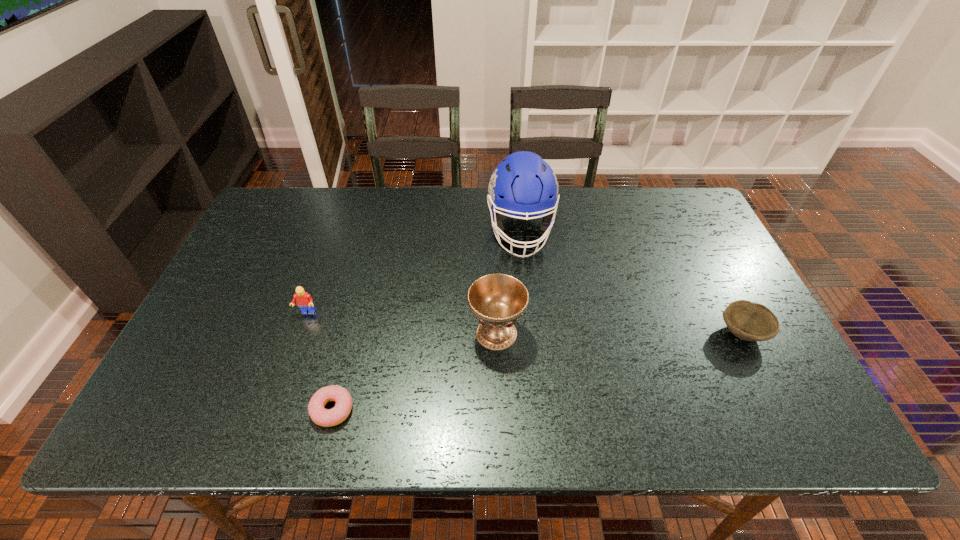
In the image, there is a desktop. Identify the location of vacant space at the right edge. (739, 350).

Locate an element on the screen. This screenshot has height=540, width=960. free space at the far right corner of the desktop is located at coordinates (677, 228).

Locate an element on the screen. free space between the leftmost object and the tallest object is located at coordinates (414, 272).

Locate an element on the screen. free spot between the third tallest object and the second shortest object is located at coordinates (524, 322).

Where is `free spot between the farthest object and the third tallest object`? Image resolution: width=960 pixels, height=540 pixels. free spot between the farthest object and the third tallest object is located at coordinates (414, 272).

The image size is (960, 540). I want to click on free space between the tallest object and the Lego, so click(414, 272).

This screenshot has height=540, width=960. Find the location of `free space that is in between the shortest object and the tallest object`. free space that is in between the shortest object and the tallest object is located at coordinates (426, 321).

Where is `vacant space that's between the doughnut and the Lego`? The width and height of the screenshot is (960, 540). vacant space that's between the doughnut and the Lego is located at coordinates (320, 361).

Find the location of `free space between the shortest object and the leftmost object`. free space between the shortest object and the leftmost object is located at coordinates (320, 361).

The height and width of the screenshot is (540, 960). Find the location of `free point between the Lego and the tallest object`. free point between the Lego and the tallest object is located at coordinates (414, 272).